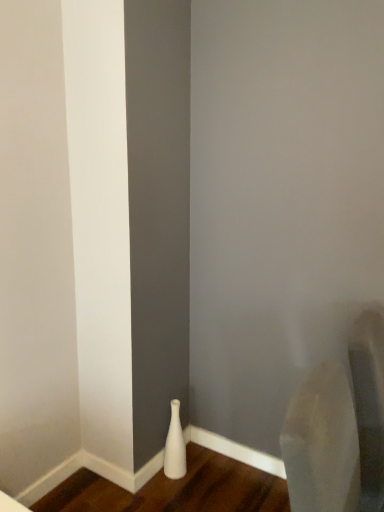
Identify the location of vacant area located to the right-hand side of white glossy vase at lower left. The image size is (384, 512). (208, 472).